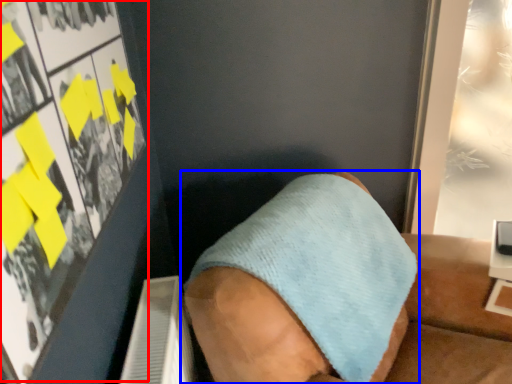
Question: Which object appears closest to the camera in this image, poster page (highlighted by a red box) or footwear (highlighted by a blue box)?

Choices:
 (A) poster page
 (B) footwear

Answer: (A)